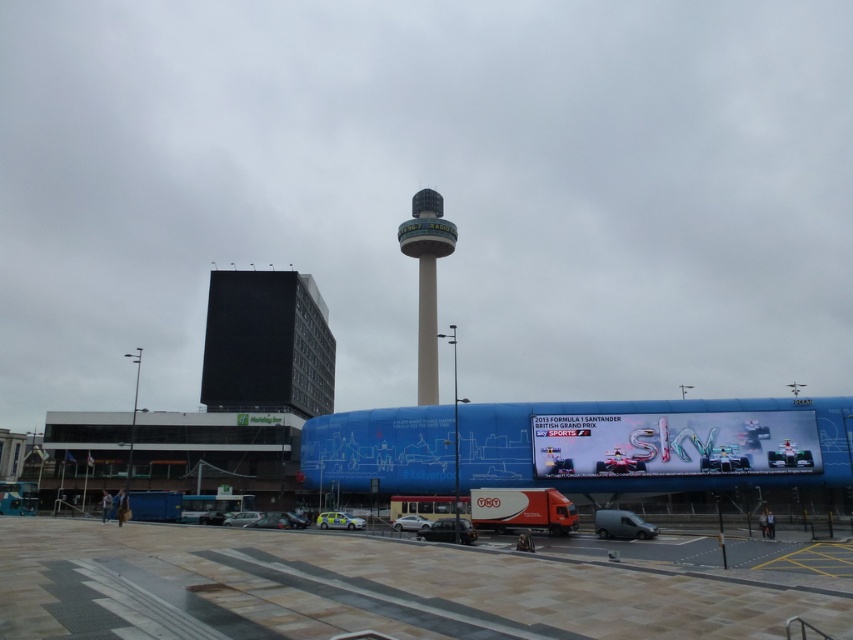
Question: Considering the real-world distances, which object is farthest from the metallic blue billboard at center?

Choices:
 (A) smooth concrete tower at center
 (B) black glass building at center
 (C) paved stone tarmac at lower center

Answer: (B)

Question: Does paved stone tarmac at lower center have a smaller size compared to smooth concrete tower at center?

Choices:
 (A) yes
 (B) no

Answer: (A)

Question: Is paved stone tarmac at lower center bigger than smooth concrete tower at center?

Choices:
 (A) no
 (B) yes

Answer: (A)

Question: Which point is farther to the camera?

Choices:
 (A) [x=213, y=356]
 (B) [x=569, y=579]
 (C) [x=567, y=440]
 (D) [x=433, y=189]

Answer: (D)

Question: Which object is the farthest from the smooth concrete tower at center?

Choices:
 (A) paved stone tarmac at lower center
 (B) black glass building at center
 (C) metallic blue billboard at center

Answer: (A)

Question: Can you confirm if black glass building at center is smaller than smooth concrete tower at center?

Choices:
 (A) yes
 (B) no

Answer: (B)